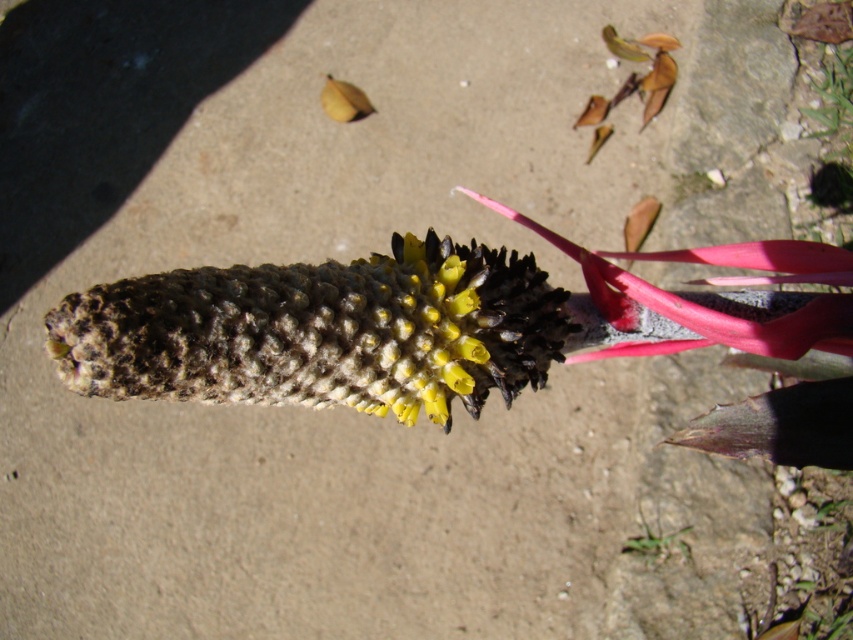
You are a botanist examining the plant. You need to determine which part of the plant is taller between the leathery brown flower at center and the green textured leaf at lower right. Based on the description, which one is taller?

The leathery brown flower at center is much taller than the green textured leaf at lower right according to the description.

You are a botanist examining the plant. From your perspective, which object is closer to you, the leathery brown flower at center or the green textured leaf at lower right?

The leathery brown flower at center is closer to you because it is in front of the green textured leaf at lower right.

You are a botanist examining the flower head of a bromeliad. You notice a point marked at coordinates (x=320, y=332). Based on the scene description, what does this point likely represent?

The point at (x=320, y=332) indicates the leathery brown flower at center.